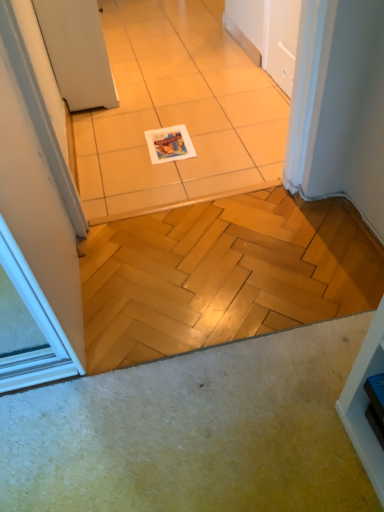
Question: Would you say white matte door at upper left is inside or outside white glossy tile at center?

Choices:
 (A) inside
 (B) outside

Answer: (B)

Question: From the image's perspective, is white matte door at upper left located above or below white glossy tile at center?

Choices:
 (A) below
 (B) above

Answer: (B)

Question: Based on their relative distances, which object is nearer to the white glossy magazine at center?

Choices:
 (A) white matte door at upper left
 (B) white glossy tile at center

Answer: (B)

Question: Estimate the real-world distances between objects in this image. Which object is farther from the white glossy magazine at center?

Choices:
 (A) white matte door at upper left
 (B) white glossy tile at center

Answer: (A)